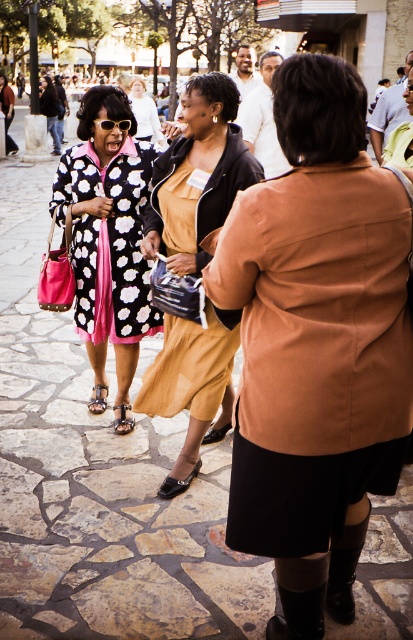
Which is in front, point (394, 333) or point (142, 138)?

Point (394, 333) is in front.

Find the location of `brown matte jacket at center`. brown matte jacket at center is located at coordinates click(x=315, y=344).

Looking at this image, who is taller, matte black dress at center or polka dot coat at center?

With more height is polka dot coat at center.

Is matte black dress at center closer to camera compared to polka dot coat at center?

Yes, matte black dress at center is in front of polka dot coat at center.

Is point (216, 128) positioned in front of point (154, 108)?

Yes, point (216, 128) is closer to viewer.

At what (x,y) coordinates should I click in order to perform the action: click on matte black dress at center. Please return your answer as a coordinate pair (x, y). This screenshot has height=640, width=413. Looking at the image, I should click on (197, 176).

Can you confirm if brown matte jacket at center is bigger than floral-patterned coat at left?

No.

You are a GUI agent. You are given a task and a screenshot of the screen. Output one action in this format:
    pyautogui.click(x=<x>, y=<y>)
    Task: Click on the brown matte jacket at center
    The width and height of the screenshot is (413, 640).
    Given the screenshot: What is the action you would take?
    pyautogui.click(x=315, y=344)